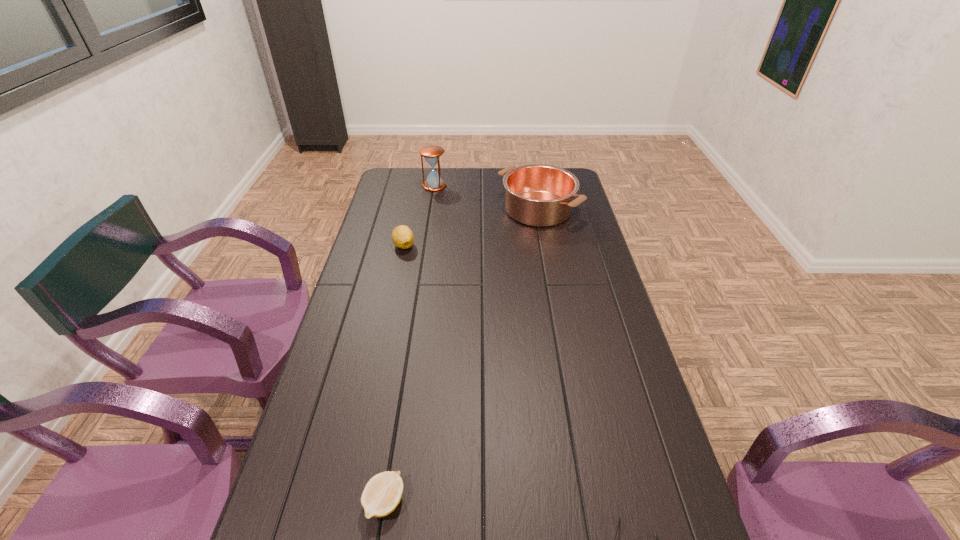
Image resolution: width=960 pixels, height=540 pixels. I want to click on hourglass, so click(x=432, y=153).

You are a GUI agent. You are given a task and a screenshot of the screen. Output one action in this format:
    pyautogui.click(x=<x>, y=<y>)
    Task: Click on the saucepan
    The image size is (960, 540).
    Given the screenshot: What is the action you would take?
    click(539, 195)

Where is `the third shortest object`? The height and width of the screenshot is (540, 960). the third shortest object is located at coordinates (402, 236).

Identify the location of the taller lemon. (402, 236).

Where is `the shorter lemon`? the shorter lemon is located at coordinates (382, 494).

This screenshot has height=540, width=960. Find the location of `the second shortest object`. the second shortest object is located at coordinates (382, 494).

The image size is (960, 540). I want to click on vacant space located on the right of the hourglass, so click(x=512, y=186).

Find the location of `vacant space situated on the front of the saucepan`. vacant space situated on the front of the saucepan is located at coordinates coord(546,251).

The height and width of the screenshot is (540, 960). What are the coordinates of `vacant space positioned 0.340m at the stem end of the third tallest object` in the screenshot? It's located at (387, 323).

Find the location of a particular element. free space located on the back of the nearer lemon is located at coordinates (410, 342).